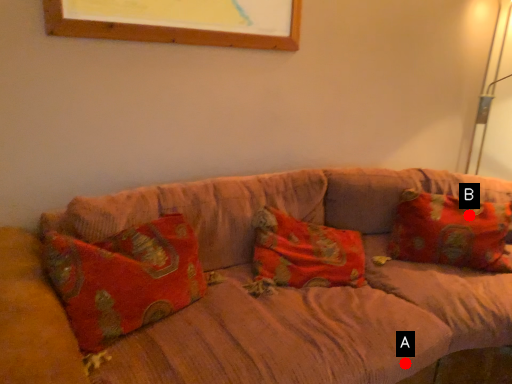
Question: Two points are circled on the image, labeled by A and B beside each circle. Which point is closer to the camera?

Choices:
 (A) A is closer
 (B) B is closer

Answer: (A)